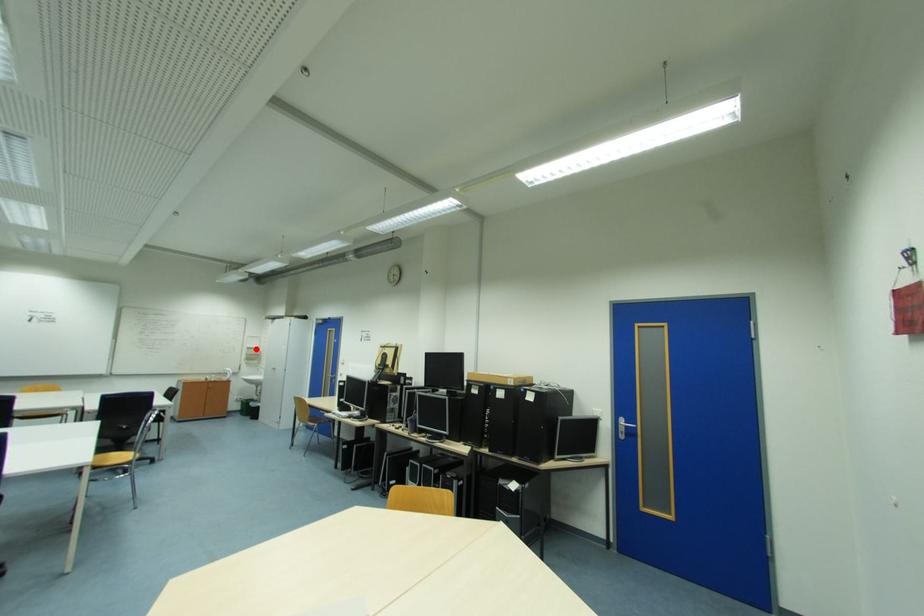
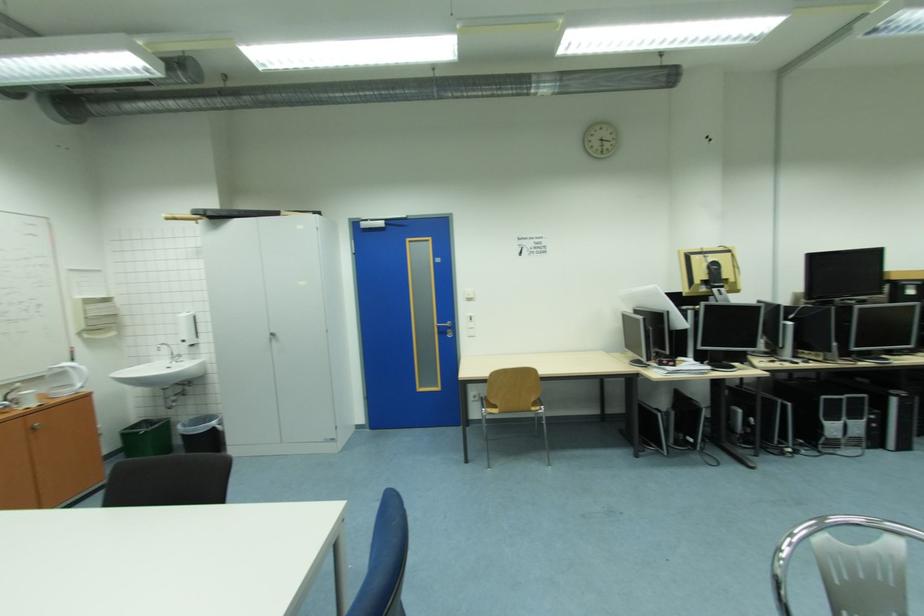
Where in the second image is the point corresponding to the highlighted location from the first image?

(94, 302)